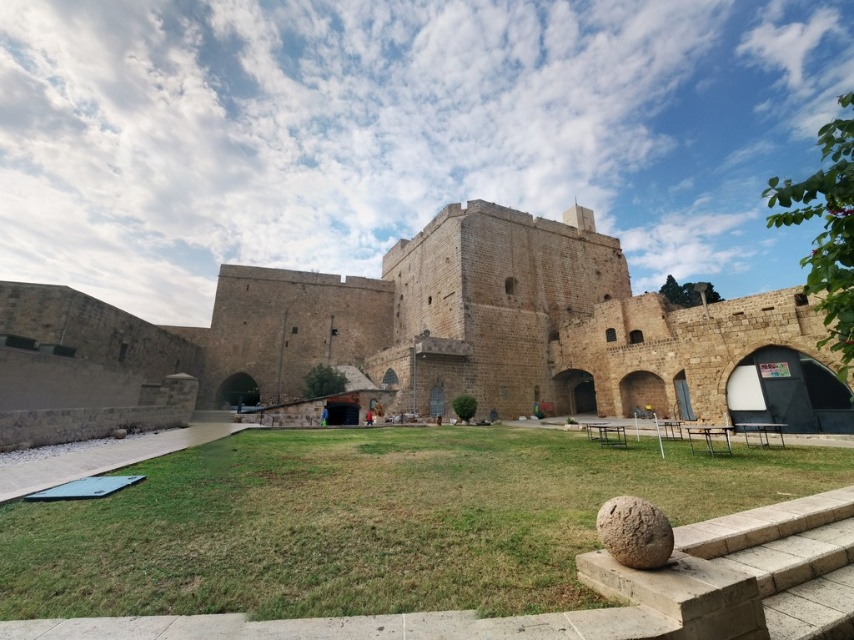
You are a tour guide explaining the layout of the fortress. Which object is wider between the brown stone fort at center and the brown rough stone at lower right?

The brown stone fort at center is wider than the brown rough stone at lower right.

You are standing at the entrance of the fortress and see two points marked in the scene. The first point is at coordinates point (1,289) and the second is at point (617,532). Which point is closer to you?

Point (1,289) is further to the camera than point (617,532). Therefore, the point closer to you is point (617,532).